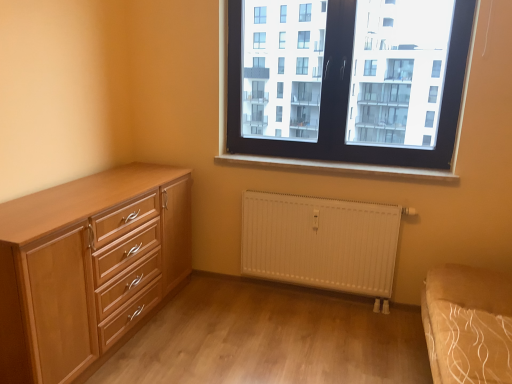
Question: From a real-world perspective, does black plastic window at upper center stand above white matte radiator at lower center?

Choices:
 (A) no
 (B) yes

Answer: (B)

Question: Does black plastic window at upper center have a larger size compared to white matte radiator at lower center?

Choices:
 (A) no
 (B) yes

Answer: (B)

Question: From the image's perspective, is black plastic window at upper center located above white matte radiator at lower center?

Choices:
 (A) yes
 (B) no

Answer: (A)

Question: Is black plastic window at upper center shorter than white matte radiator at lower center?

Choices:
 (A) no
 (B) yes

Answer: (A)

Question: Is black plastic window at upper center positioned far away from white matte radiator at lower center?

Choices:
 (A) yes
 (B) no

Answer: (B)

Question: Can you confirm if black plastic window at upper center is thinner than white matte radiator at lower center?

Choices:
 (A) no
 (B) yes

Answer: (A)

Question: Is white painted wood at center outside light wood chest of drawers at left?

Choices:
 (A) no
 (B) yes

Answer: (B)

Question: Does white painted wood at center have a lesser width compared to light wood chest of drawers at left?

Choices:
 (A) no
 (B) yes

Answer: (B)

Question: Is white painted wood at center not close to light wood chest of drawers at left?

Choices:
 (A) no
 (B) yes

Answer: (B)

Question: Is white painted wood at center wider than light wood chest of drawers at left?

Choices:
 (A) no
 (B) yes

Answer: (A)

Question: Is white painted wood at center positioned with its back to light wood chest of drawers at left?

Choices:
 (A) no
 (B) yes

Answer: (A)

Question: From a real-world perspective, is white painted wood at center physically above light wood chest of drawers at left?

Choices:
 (A) yes
 (B) no

Answer: (A)

Question: Can you confirm if white painted wood at center is shorter than white matte radiator at lower center?

Choices:
 (A) no
 (B) yes

Answer: (B)